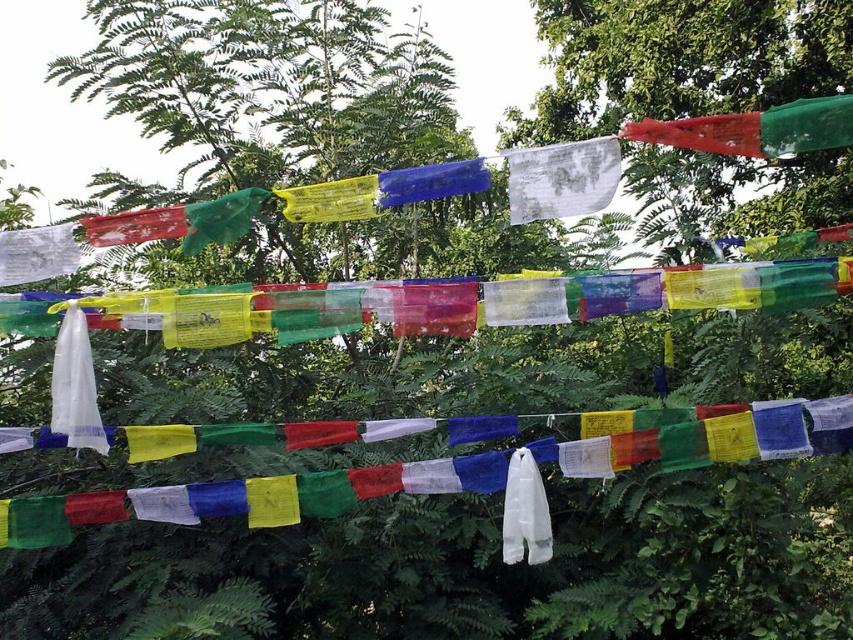
Question: Which point is farther from the camera taking this photo?

Choices:
 (A) (315, 484)
 (B) (440, 164)

Answer: (A)

Question: Which point is farther to the camera?

Choices:
 (A) (480, 160)
 (B) (840, 109)
 (C) (605, 106)

Answer: (C)

Question: Can you confirm if red translucent flag at upper right is wider than white sheer fabric at center?

Choices:
 (A) no
 (B) yes

Answer: (B)

Question: Does white sheer fabric at center have a larger size compared to yellow translucent flag at center?

Choices:
 (A) yes
 (B) no

Answer: (A)

Question: Among these points, which one is farthest from the camera?

Choices:
 (A) (393, 198)
 (B) (572, 154)

Answer: (A)

Question: Is transparent plastic bag at lower left to the left of white sheer fabric at center from the viewer's perspective?

Choices:
 (A) no
 (B) yes

Answer: (A)